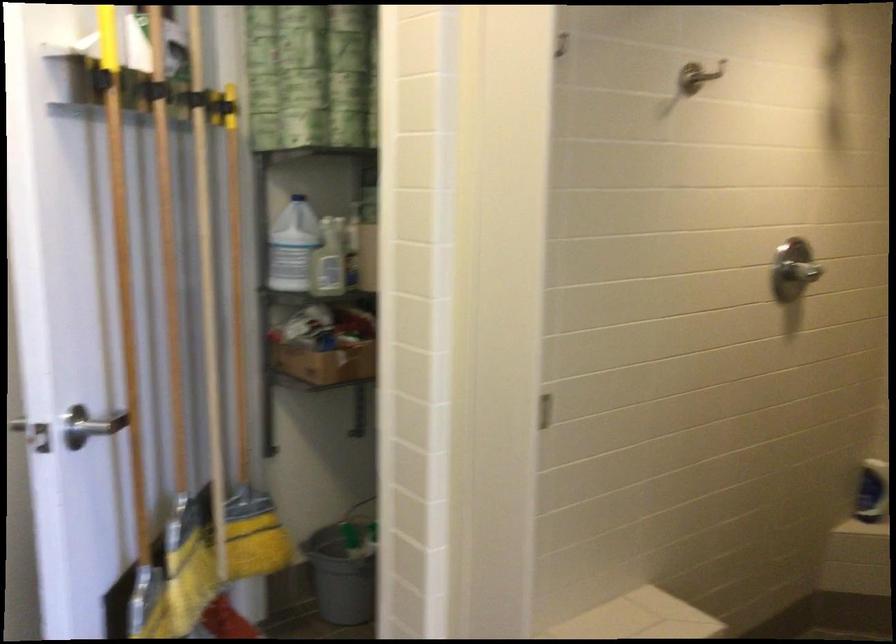
Find the location of `white plastic jug`. white plastic jug is located at coordinates (291, 245).